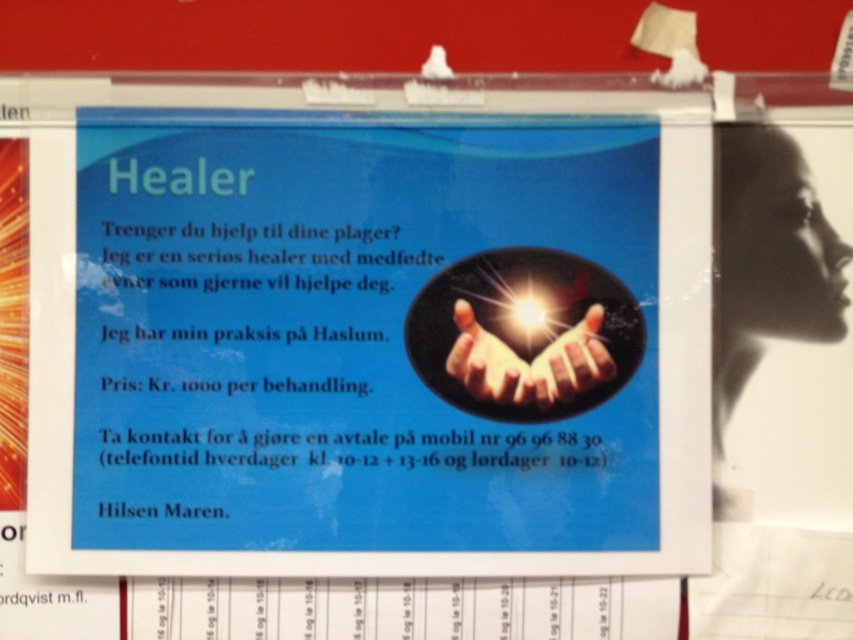
Based on the scene description, where is the shiny golden hands at center located in terms of coordinates?

The shiny golden hands at center are located at coordinates point (527, 362).

Looking at the poster pinned to the red surface, you notice the two hands at the center. Which one is taller between the shiny golden hands at center and the translucent glowing hands at center?

The shiny golden hands at center is taller than the translucent glowing hands at center.

You are looking at a poster on a red bulletin board. The poster has a blue gradient background. There is a shiny golden hands graphic at the center. Where exactly on the poster are the shiny golden hands at center positioned in terms of coordinates?

The shiny golden hands at center are located at point (527,362) coordinates on the poster.